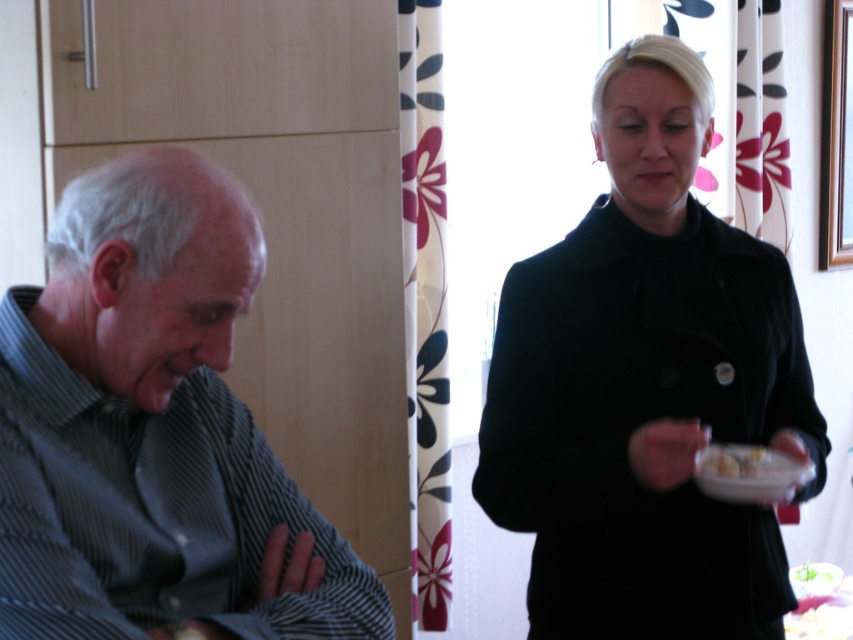
Looking at this image, you are standing at the point labeled as point (764, 512) in the image. You want to hand the small white plate you are holding to the older man on the left. Can you reach him without moving your feet? The older man is seated and his arms are crossed over his chest.

The distance between you and the older man is 1.56 meters. Since the average human arm length is about 0.7 meters, you cannot reach him without moving your feet as the distance is greater than the combined arm lengths.

You are standing in the room and want to reach the point marked as point (567, 285). If your average walking speed is 3 feet per second, how long will it take you to reach that point?

The distance between you and point (567, 285) is 5.05 feet. At a speed of 3 feet per second, it would take approximately 1.68 seconds to reach the point.

You are a delivery person who needs to place a package on a surface. You see the striped shirt at left and the white glossy bowl at upper right. Which object can you place the package on?

The striped shirt at left has a larger size compared to the white glossy bowl at upper right, so the striped shirt at left is more suitable for placing the package as it provides a larger and steadier surface.